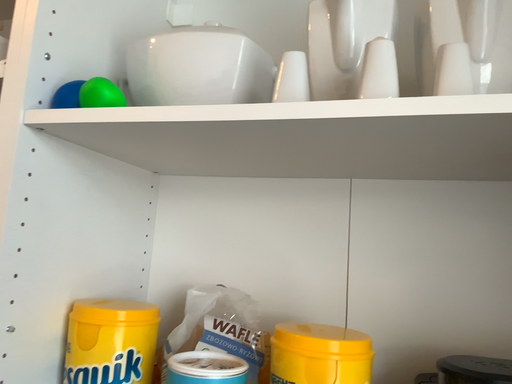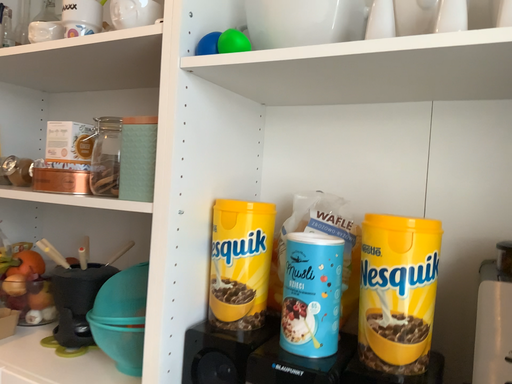
Question: How did the camera likely rotate when shooting the video?

Choices:
 (A) rotated left
 (B) rotated right

Answer: (A)